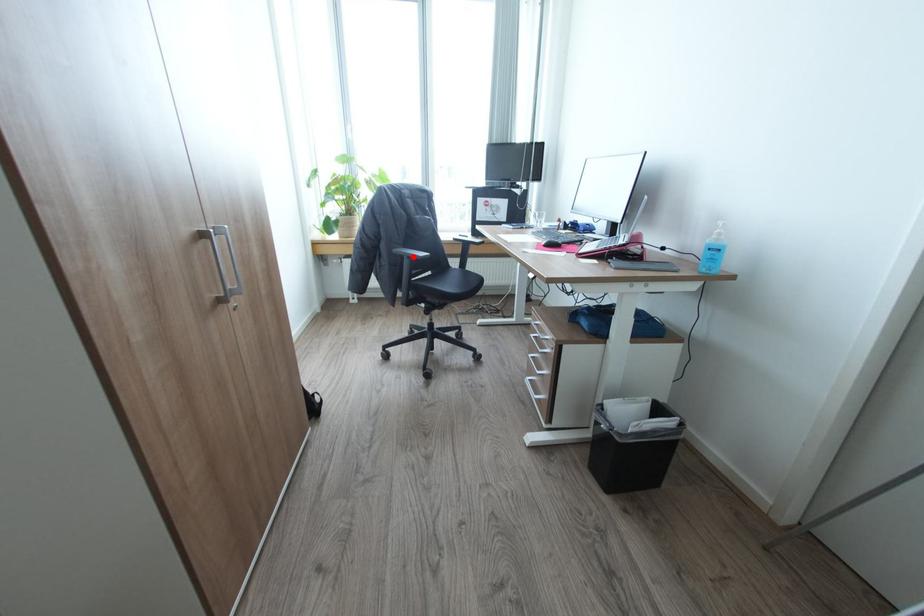
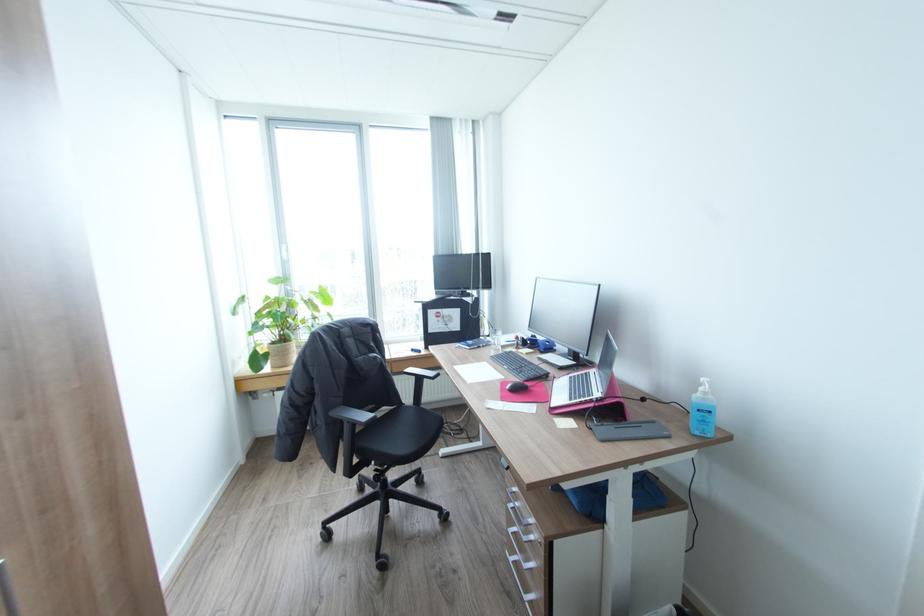
Find the pixel in the second image that matches the highlighted location in the first image.

(354, 422)